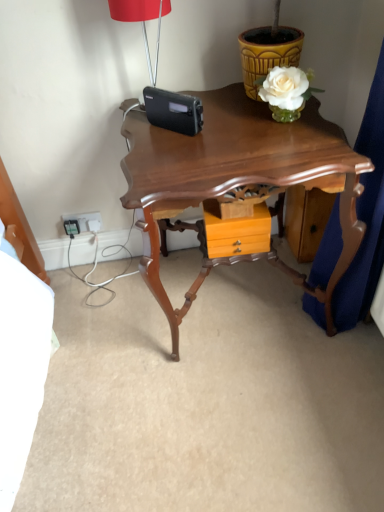
Question: Is yellow textured flowerpot at upper right inside or outside of shiny brown wooden table at center?

Choices:
 (A) inside
 (B) outside

Answer: (B)

Question: From their relative heights in the image, would you say yellow textured flowerpot at upper right is taller or shorter than shiny brown wooden table at center?

Choices:
 (A) short
 (B) tall

Answer: (A)

Question: Estimate the real-world distances between objects in this image. Which object is farther from the shiny brown wooden table at center?

Choices:
 (A) white plastic electrical outlet at lower left
 (B) matte red lampshade at upper center
 (C) orange wood drawer at center
 (D) yellow textured flowerpot at upper right

Answer: (A)

Question: Considering the real-world distances, which object is closest to the matte red lampshade at upper center?

Choices:
 (A) white plastic electrical outlet at lower left
 (B) yellow textured flowerpot at upper right
 (C) orange wood drawer at center
 (D) shiny brown wooden table at center

Answer: (B)